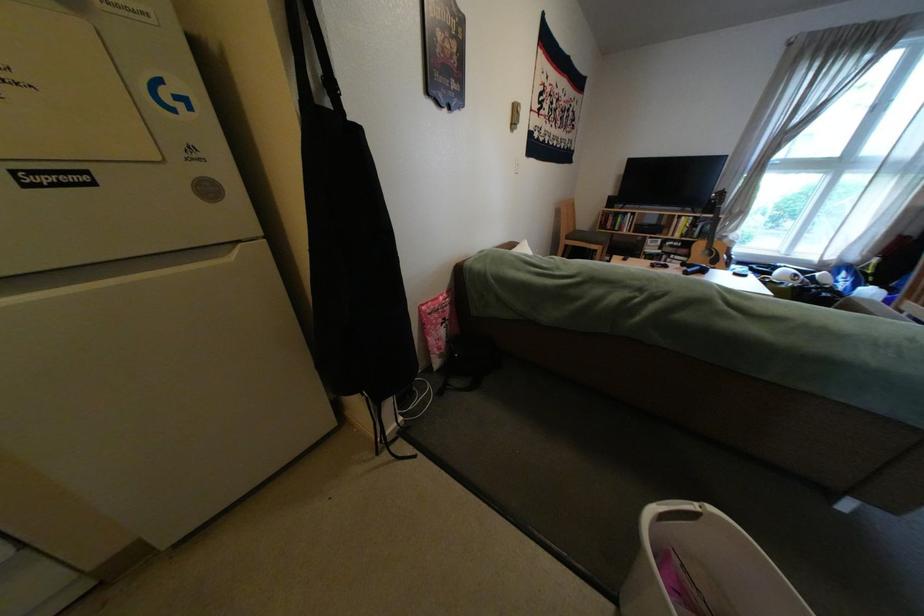
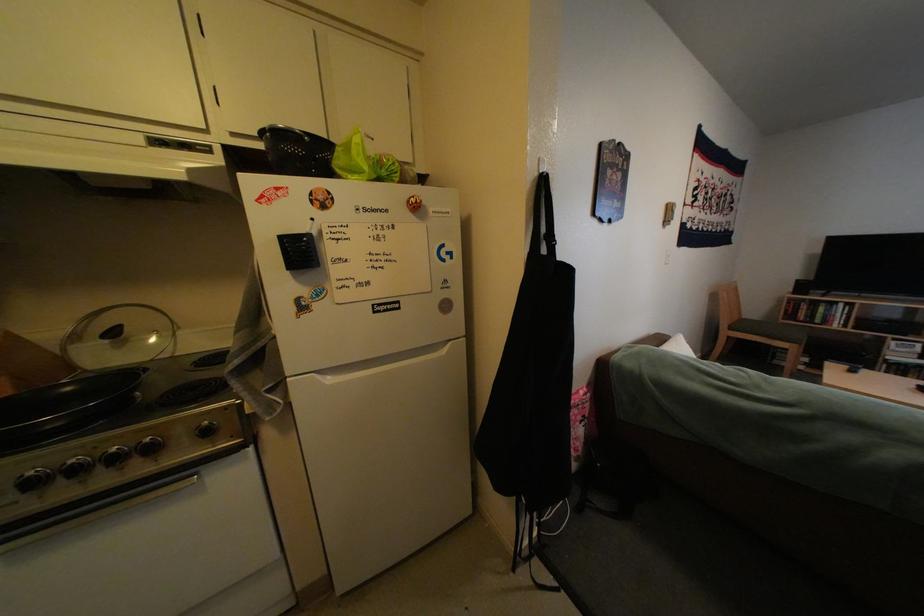
Find the pixel in the second image that matches pixel 622 260 in the first image.

(820, 361)